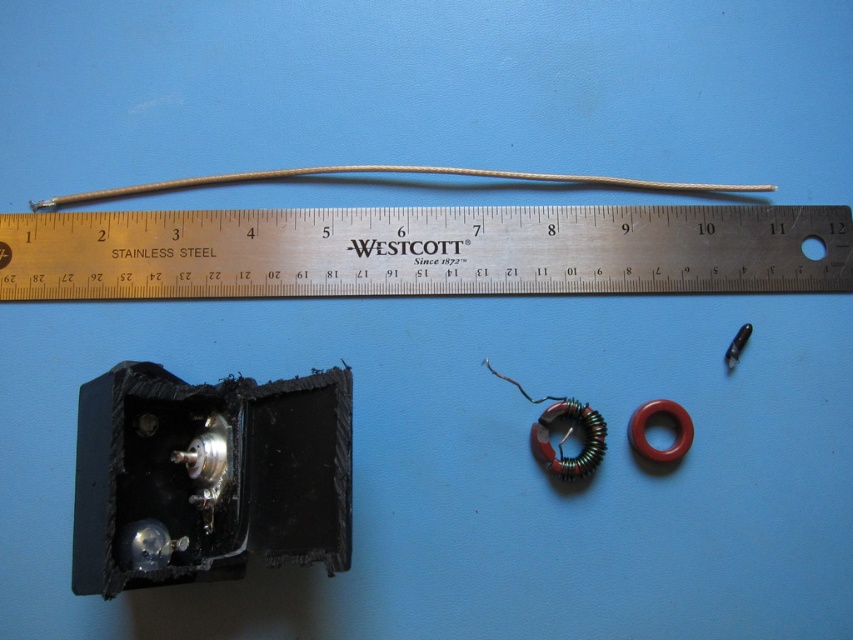
Which is in front, point (747, 257) or point (380, 168)?

Point (747, 257) is more forward.

Does stainless steel ruler at upper center have a lesser width compared to gray matte wire at center?

Incorrect, stainless steel ruler at upper center's width is not less than gray matte wire at center's.

Which is in front, point (772, 259) or point (158, 193)?

Point (772, 259) is more forward.

Find the location of a particular element. This screenshot has height=640, width=853. stainless steel ruler at upper center is located at coordinates (422, 252).